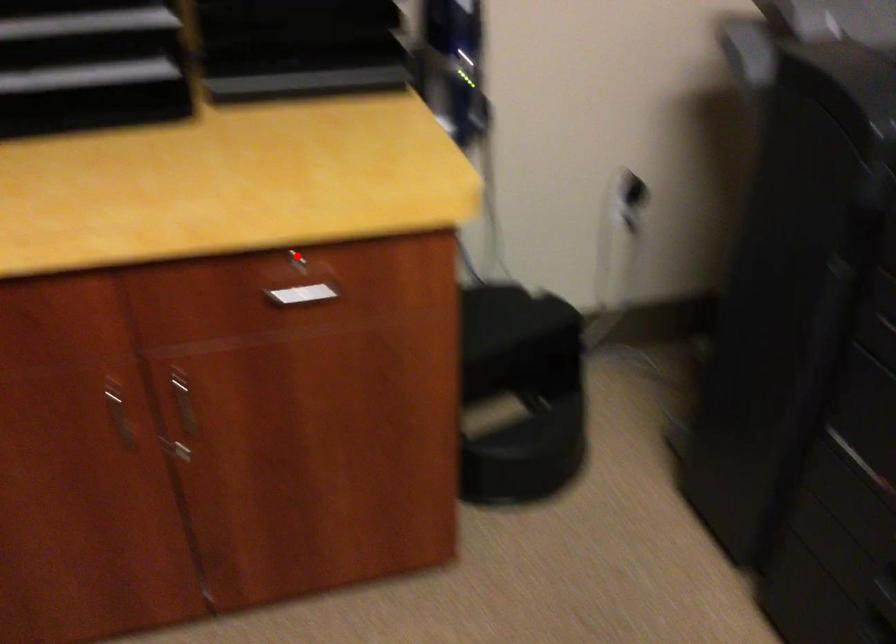
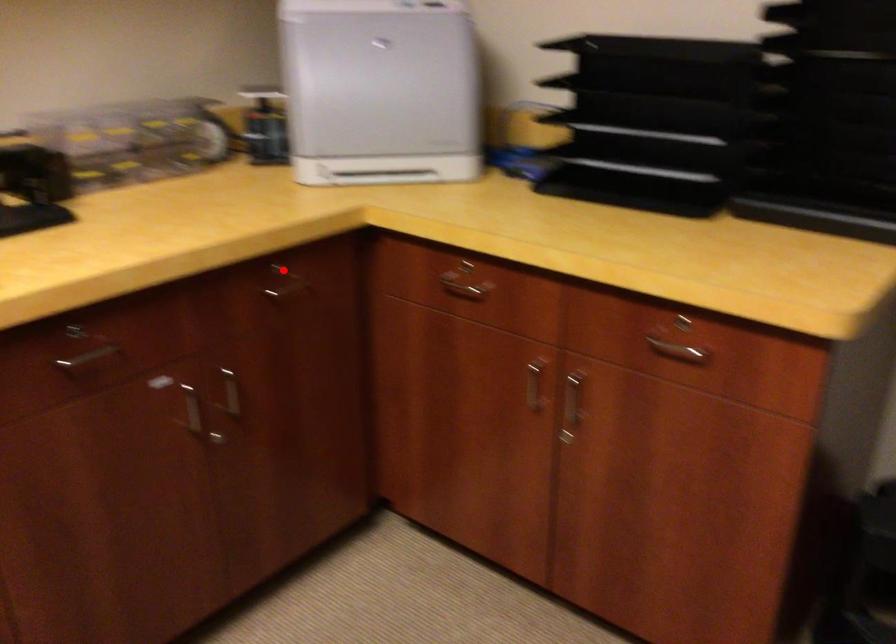
I am providing you with two images of the same scene from different viewpoints. A red point is marked on the first image and another point is marked on the second image. Do the highlighted points in image1 and image2 indicate the same real-world spot?

No